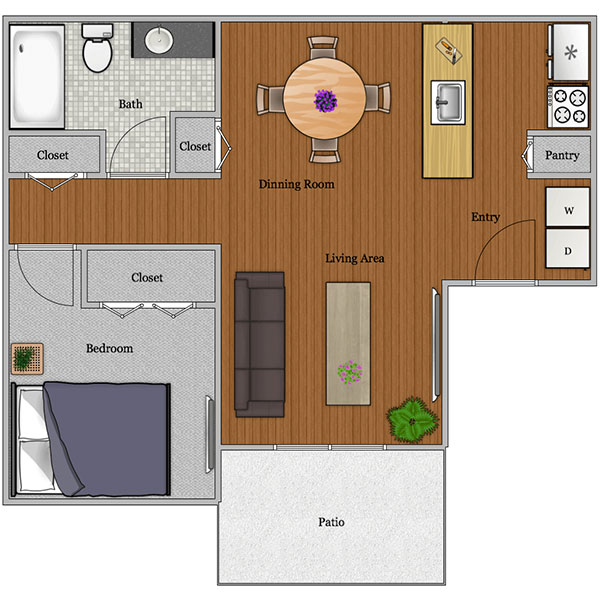
I want to click on point between kitchen, dining and living areas, so coord(420,228).